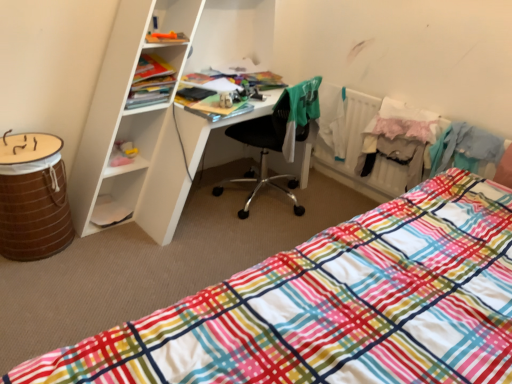
Question: Is point (51, 211) positioned closer to the camera than point (423, 117)?

Choices:
 (A) closer
 (B) farther

Answer: (A)

Question: Considering their positions, is brown woven barrel at lower left located in front of or behind white lace skirt at right, the 1th clothing viewed from the right?

Choices:
 (A) behind
 (B) front

Answer: (B)

Question: Estimate the real-world distances between objects in this image. Which object is closer to the matte plastic cabinet at upper left?

Choices:
 (A) plaid fabric bed at lower right
 (B) brown woven barrel at lower left
 (C) white lace skirt at right, the 1th clothing viewed from the right
 (D) black plastic chair at center
 (E) green fabric shirt at center, which is counted as the 2th clothing, starting from the right

Answer: (D)

Question: Based on their relative distances, which object is farther from the black plastic chair at center?

Choices:
 (A) matte plastic cabinet at upper left
 (B) white lace skirt at right, acting as the 2th clothing starting from the left
 (C) brown woven barrel at lower left
 (D) plaid fabric bed at lower right
 (E) green fabric shirt at center, which is counted as the 2th clothing, starting from the right

Answer: (C)